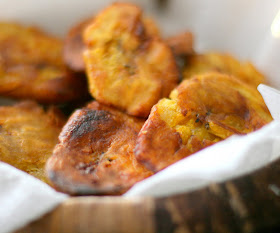
Locate an element on the screen. The width and height of the screenshot is (280, 233). wooden style dish is located at coordinates (122, 212).